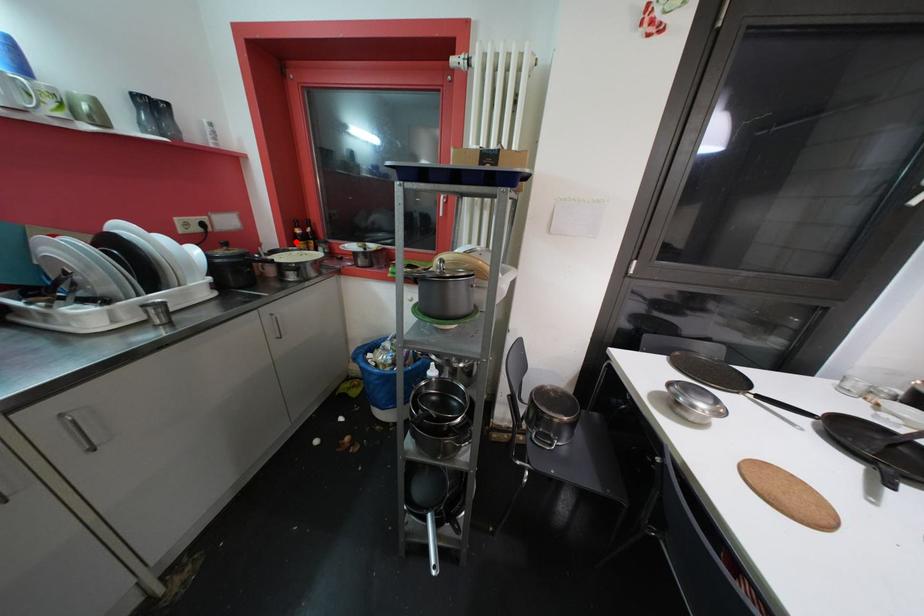
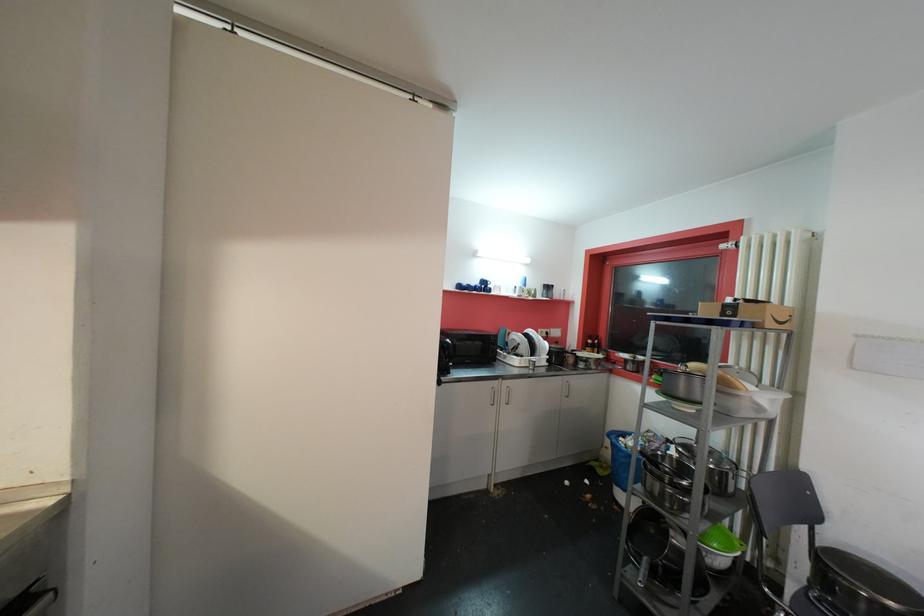
Question: I am providing you with two images of the same scene from different viewpoints. Given a red point in image1, look at the same physical point in image2. Is it:

Choices:
 (A) Closer to the viewpoint
 (B) Farther from the viewpoint

Answer: (B)